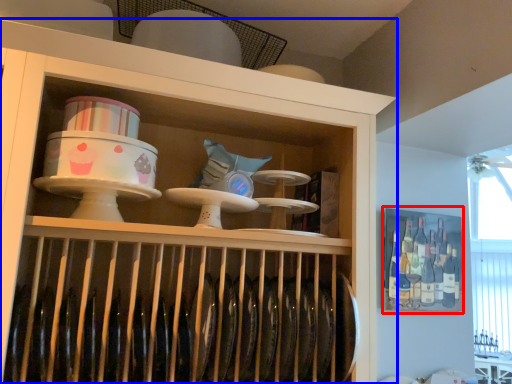
Question: Which of the following is the closest to the observer, cabinet (highlighted by a red box) or shelf (highlighted by a blue box)?

Choices:
 (A) cabinet
 (B) shelf

Answer: (B)